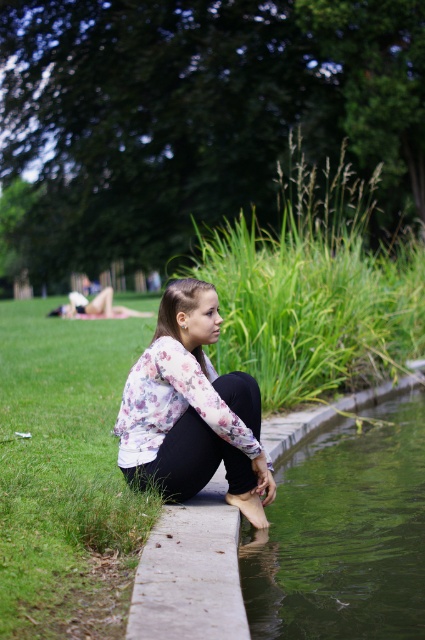
Can you confirm if floral fabric shirt at center is positioned to the left of white fabric blanket at upper left?

No, floral fabric shirt at center is not to the left of white fabric blanket at upper left.

Which is behind, point (207, 371) or point (84, 304)?

The point (84, 304) is behind.

Where is `floral fabric shirt at center`? Image resolution: width=425 pixels, height=640 pixels. floral fabric shirt at center is located at coordinates (192, 410).

Where is `floral fabric shirt at center`? Image resolution: width=425 pixels, height=640 pixels. floral fabric shirt at center is located at coordinates (192, 410).

Is point (323, 538) closer to viewer compared to point (118, 316)?

Yes, it is.

Which is in front, point (416, 560) or point (78, 298)?

Point (416, 560) is in front.

Does point (351, 493) come farther from viewer compared to point (124, 314)?

No.

Image resolution: width=425 pixels, height=640 pixels. Identify the location of green smooth water at lower center. (343, 534).

Between green smooth water at lower center and floral fabric shirt at center, which one is positioned lower?

green smooth water at lower center is lower down.

Does point (294, 616) come farther from viewer compared to point (201, 321)?

No.

Where is `green smooth water at lower center`? green smooth water at lower center is located at coordinates (343, 534).